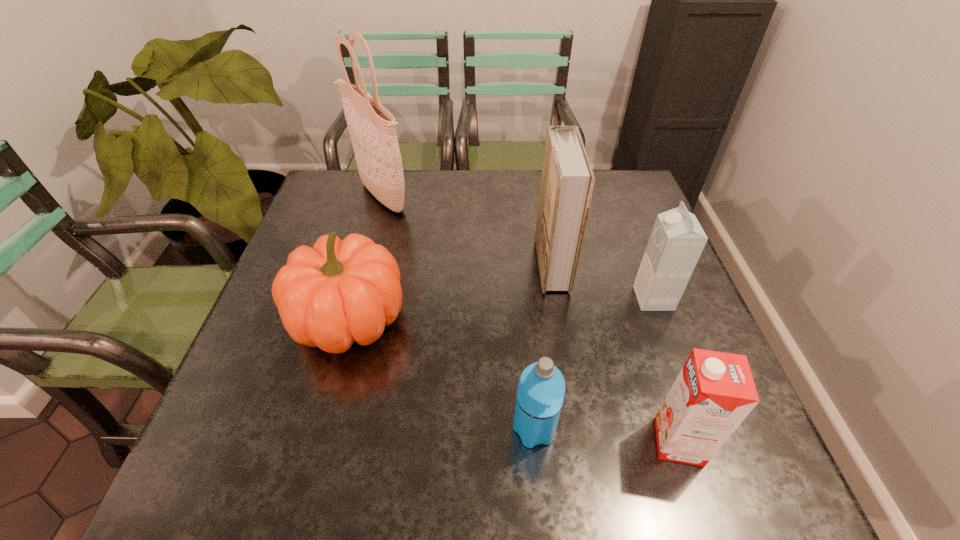
Locate an element on the screen. the tallest object is located at coordinates (371, 126).

At what (x,y) coordinates should I click in order to perform the action: click on the farthest object. Please return your answer as a coordinate pair (x, y). The width and height of the screenshot is (960, 540). Looking at the image, I should click on (371, 126).

At what (x,y) coordinates should I click in order to perform the action: click on phonebook. Please return your answer as a coordinate pair (x, y). The image size is (960, 540). Looking at the image, I should click on (567, 181).

Locate an element on the screen. The height and width of the screenshot is (540, 960). the fifth shortest object is located at coordinates (567, 181).

Where is `the farther carton`? This screenshot has height=540, width=960. the farther carton is located at coordinates (677, 240).

The image size is (960, 540). I want to click on pumpkin, so click(340, 291).

This screenshot has width=960, height=540. I want to click on the nearer carton, so click(x=714, y=392).

Locate an element on the screen. Image resolution: width=960 pixels, height=540 pixels. the third object from left to right is located at coordinates [x=541, y=388].

Find the location of a particular element. vacant space positioned 0.320m on the front of the tallest object is located at coordinates (349, 312).

This screenshot has height=540, width=960. I want to click on free point located 0.290m on the cover of the phonebook, so click(x=425, y=264).